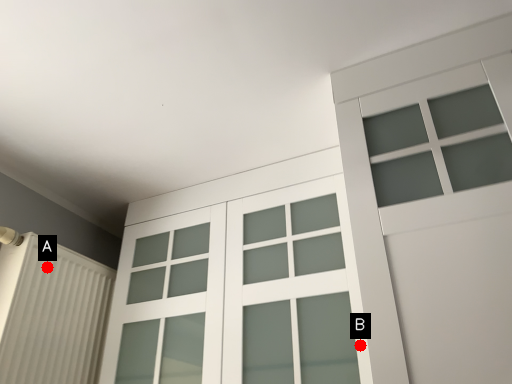
Question: Two points are circled on the image, labeled by A and B beside each circle. Among these points, which one is farthest from the camera?

Choices:
 (A) A is further
 (B) B is further

Answer: (A)